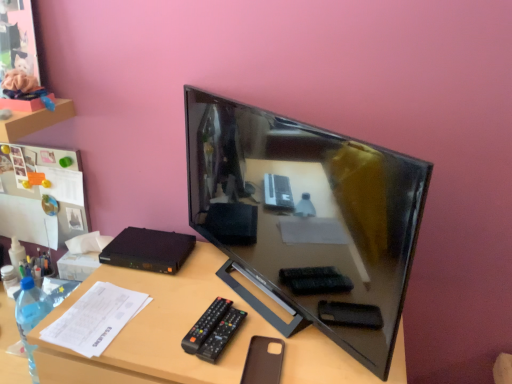
You are a GUI agent. You are given a task and a screenshot of the screen. Output one action in this format:
    pyautogui.click(x=<x>, y=<y>)
    Task: Click on the vacant space situated on the left part of black plastic remote at lower center
    
    Given the screenshot: What is the action you would take?
    pyautogui.click(x=160, y=327)